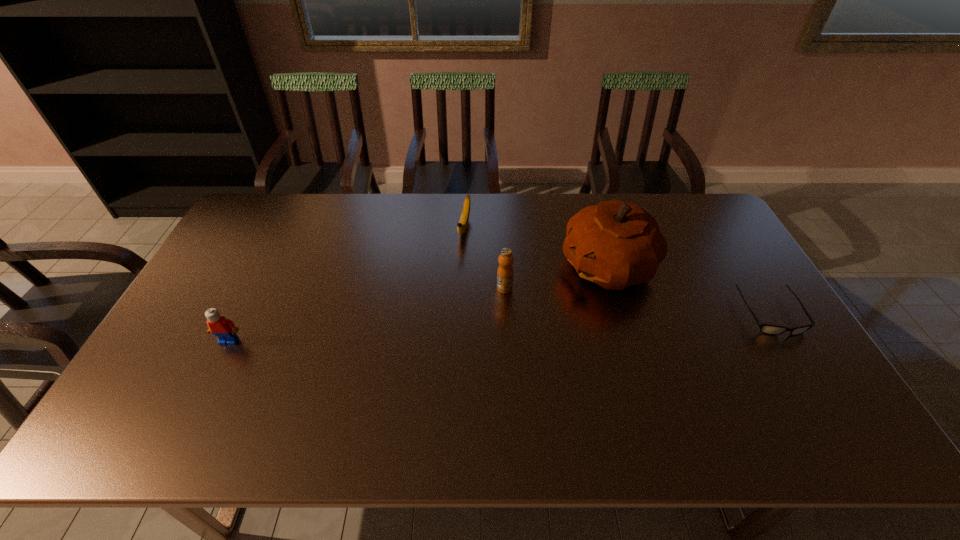
The width and height of the screenshot is (960, 540). In order to click on blank region between the second tallest object and the second shortest object in this screenshot , I will do `click(485, 258)`.

This screenshot has height=540, width=960. In order to click on free space that is in between the third object from left to right and the tallest object in this screenshot , I will do `click(556, 278)`.

At what (x,y) coordinates should I click in order to perform the action: click on free space between the third shortest object and the third object from left to right. Please return your answer as a coordinate pair (x, y). This screenshot has width=960, height=540. Looking at the image, I should click on (367, 315).

Where is `vacant area between the third object from left to right and the third shortest object`? vacant area between the third object from left to right and the third shortest object is located at coordinates (367, 315).

You are a GUI agent. You are given a task and a screenshot of the screen. Output one action in this format:
    pyautogui.click(x=<x>, y=<y>)
    Task: Click on the free space between the shortest object and the orange juice
    This screenshot has width=960, height=540.
    Given the screenshot: What is the action you would take?
    pyautogui.click(x=637, y=301)

At what (x,y) coordinates should I click in order to perform the action: click on free spot between the banana and the orange juice. Please return your answer as a coordinate pair (x, y). The height and width of the screenshot is (540, 960). Looking at the image, I should click on (485, 258).

Locate an element on the screen. This screenshot has width=960, height=540. free point between the leftmost object and the shortest object is located at coordinates (500, 327).

Where is `blank region between the Lego and the orange juice`? blank region between the Lego and the orange juice is located at coordinates (367, 315).

Locate which object is the closest to the third tallest object. Please provide its 2D coordinates. Your answer should be formatted as a tuple, i.e. [(x, y)], where the tuple contains the x and y coordinates of a point satisfying the conditions above.

[(463, 223)]

Locate which object ranks in proximity to the Lego. Please provide its 2D coordinates. Your answer should be formatted as a tuple, i.e. [(x, y)], where the tuple contains the x and y coordinates of a point satisfying the conditions above.

[(463, 223)]